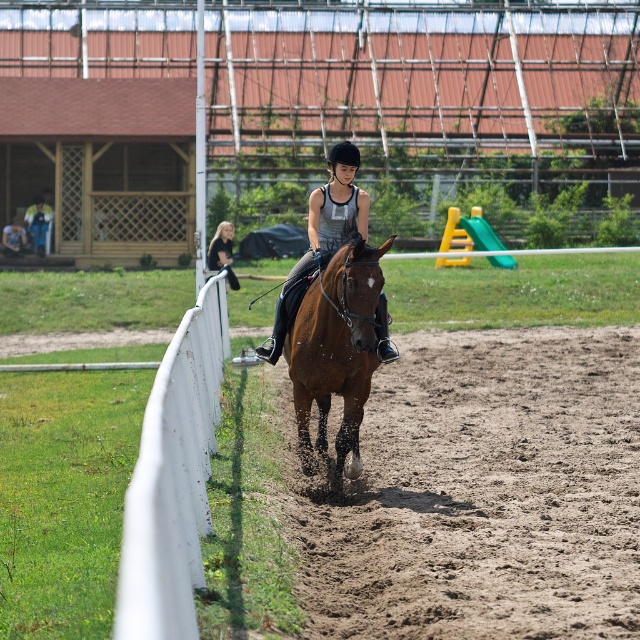
You are a photographer standing at the edge of the track. You want to take a photo of the brown glossy horse at center and the black leather jacket at upper center. Based on their positions, will the horse be visible in the photo if you focus on the jacket?

The brown glossy horse at center is positioned under the black leather jacket at upper center, so if you focus on the jacket, the horse will still be visible in the photo as it is located directly beneath it.

What is the material and color of the object located at coordinate point (x=173, y=477) in the equestrian training facility scene?

The object at coordinate point (x=173, y=477) is white painted wood.